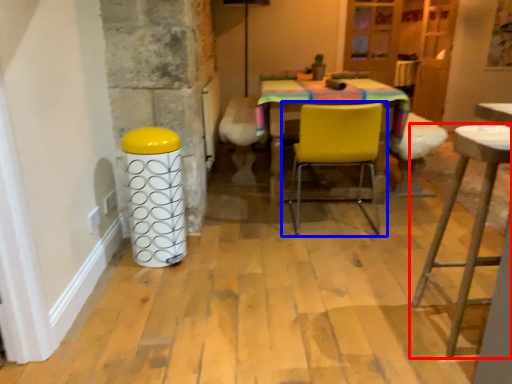
Question: Among these objects, which one is nearest to the camera, stool (highlighted by a red box) or chair (highlighted by a blue box)?

Choices:
 (A) stool
 (B) chair

Answer: (A)